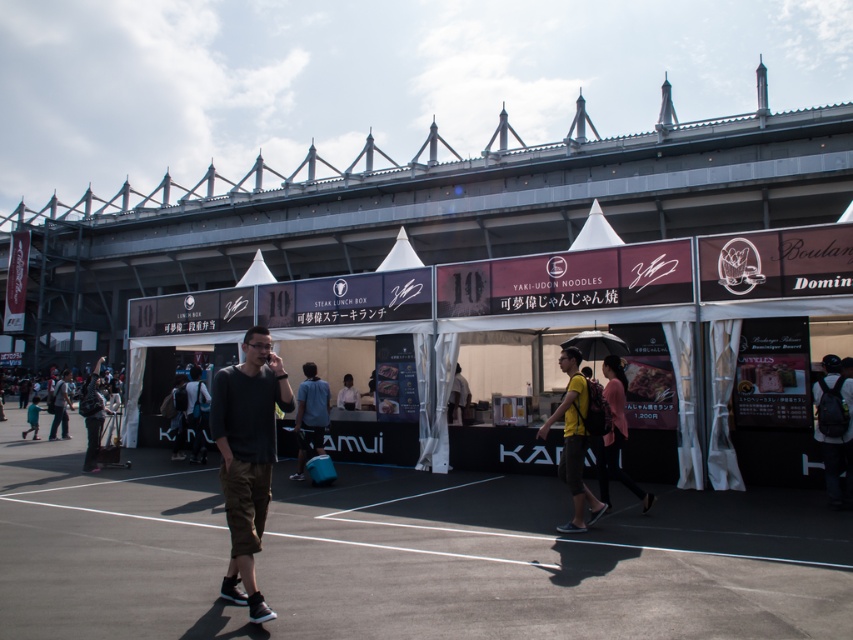
Question: Can you confirm if black matte pants at center is wider than yellow fabric shirt at center?

Choices:
 (A) no
 (B) yes

Answer: (A)

Question: Among these points, which one is farthest from the camera?

Choices:
 (A) (836, 381)
 (B) (413, 253)

Answer: (B)

Question: Does pink fabric shirt at center appear under dark gray fabric shirt at center?

Choices:
 (A) yes
 (B) no

Answer: (B)

Question: Which point is closer to the camera taking this photo?

Choices:
 (A) (602, 435)
 (B) (402, 240)
 (C) (577, 406)

Answer: (C)

Question: Which point appears closest to the camera in this image?

Choices:
 (A) (840, 390)
 (B) (346, 387)

Answer: (A)

Question: Does black backpack at lower right appear on the left side of white fabric canopy at center?

Choices:
 (A) yes
 (B) no

Answer: (B)